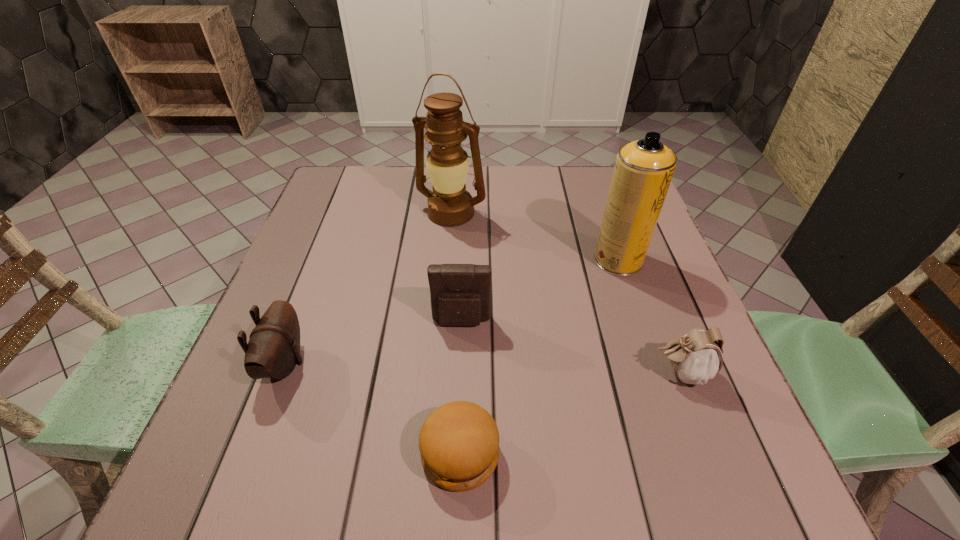
Locate an element on the screen. The height and width of the screenshot is (540, 960). pouch located at the right edge is located at coordinates (696, 357).

In order to click on vacant area at the far edge in this screenshot , I will do 414,181.

Identify the location of free region at the left edge. Image resolution: width=960 pixels, height=540 pixels. click(x=335, y=234).

In order to click on vacant space at the right edge in this screenshot , I will do `click(746, 428)`.

The width and height of the screenshot is (960, 540). Find the location of `free space at the far right corner of the desktop`. free space at the far right corner of the desktop is located at coordinates (587, 168).

Find the location of a particular element. The height and width of the screenshot is (540, 960). empty space that is in between the farthest object and the rightmost pouch is located at coordinates (565, 293).

At what (x,y) coordinates should I click in order to perform the action: click on unoccupied position between the leftmost pouch and the hamburger. Please return your answer as a coordinate pair (x, y). This screenshot has height=540, width=960. Looking at the image, I should click on (372, 409).

This screenshot has height=540, width=960. What are the coordinates of `free area in between the hamburger and the oil lamp` in the screenshot? It's located at (456, 333).

I want to click on blank region between the leftmost pouch and the oil lamp, so click(x=368, y=288).

At what (x,y) coordinates should I click in order to perform the action: click on free space between the shortest object and the oil lamp. Please return your answer as a coordinate pair (x, y). The image size is (960, 540). Looking at the image, I should click on (456, 333).